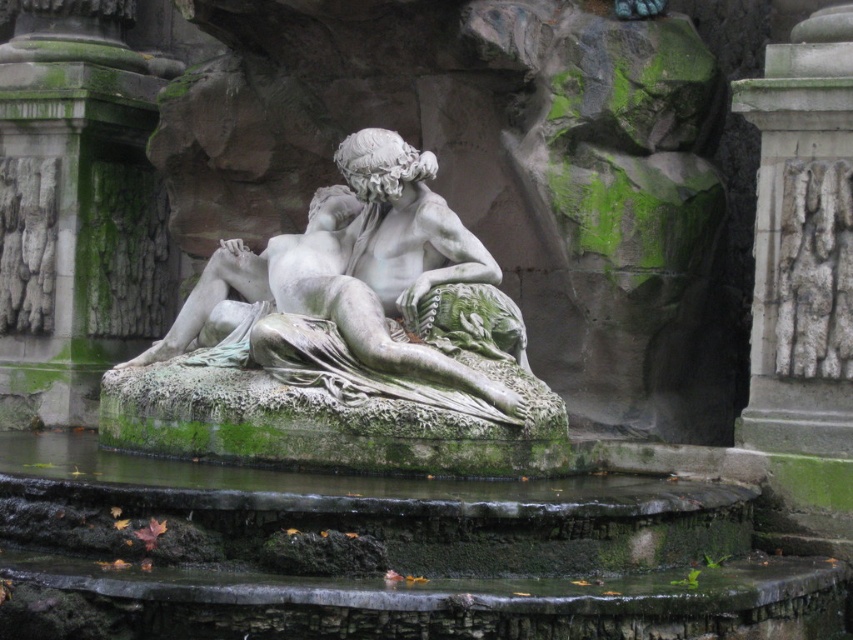
Who is positioned more to the left, white marble statue at center or white stone carving at right?

white marble statue at center is more to the left.

Is white marble statue at center taller than white stone carving at right?

No, white marble statue at center is not taller than white stone carving at right.

Measure the distance between point (471, 413) and camera.

Point (471, 413) and camera are 54.57 meters apart.

Find the location of a particular element. The image size is (853, 640). white marble statue at center is located at coordinates (361, 296).

Does green mossy stone column at center have a lesser height compared to white stone carving at right?

No.

Does point (39, 205) lie in front of point (773, 173)?

No, it is behind (773, 173).

Where is `green mossy stone column at center`? The width and height of the screenshot is (853, 640). green mossy stone column at center is located at coordinates (76, 205).

This screenshot has width=853, height=640. Identify the location of green mossy stone column at center. (76, 205).

Is green mossy stone column at center behind white marble statue at center?

Yes, it is.

Is green mossy stone column at center to the right of white marble statue at center from the viewer's perspective?

No, green mossy stone column at center is not to the right of white marble statue at center.

Is point (22, 170) closer to viewer compared to point (283, 259)?

No.

This screenshot has height=640, width=853. I want to click on green mossy stone column at center, so click(x=76, y=205).